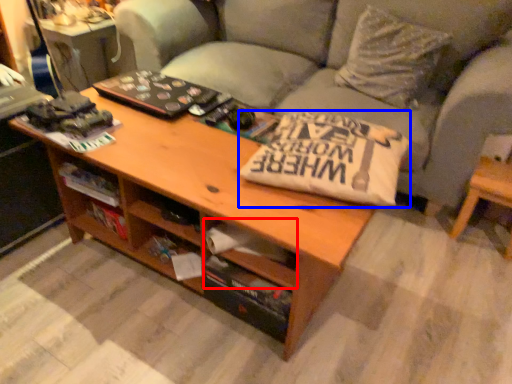
Question: Which point is closer to the camera, drawer (highlighted by a red box) or pillow (highlighted by a blue box)?

Choices:
 (A) drawer
 (B) pillow

Answer: (B)